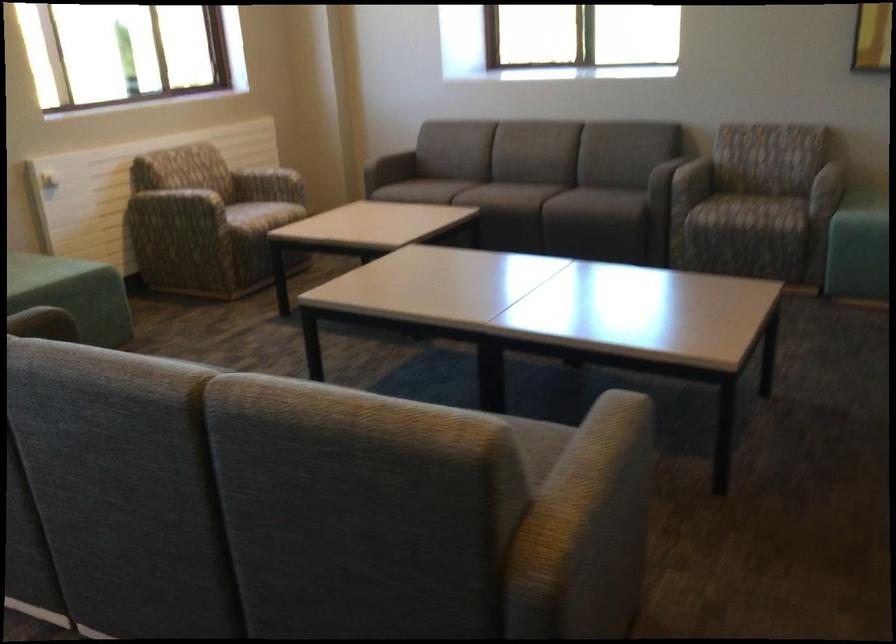
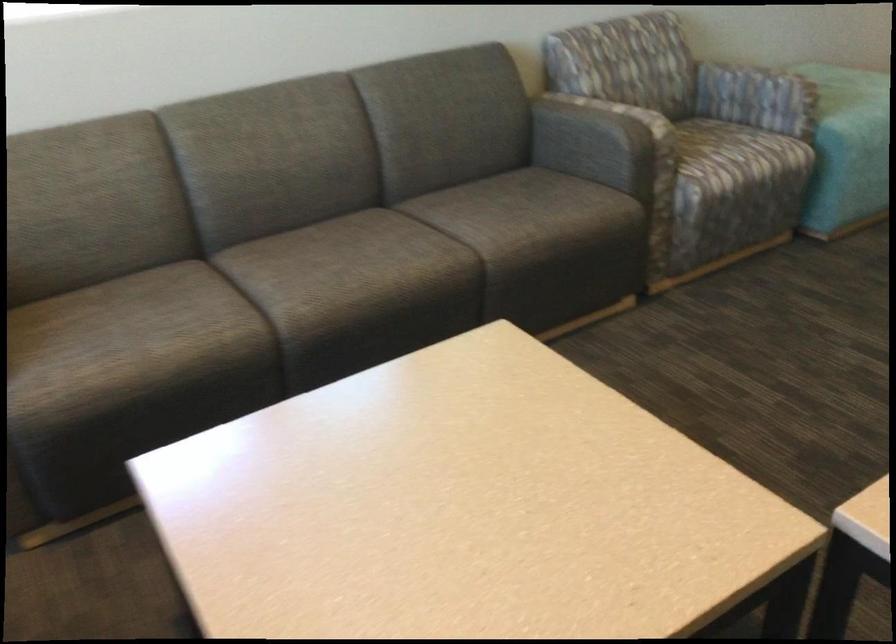
The point at [790,169] is marked in the first image. Where is the corresponding point in the second image?

(728, 84)